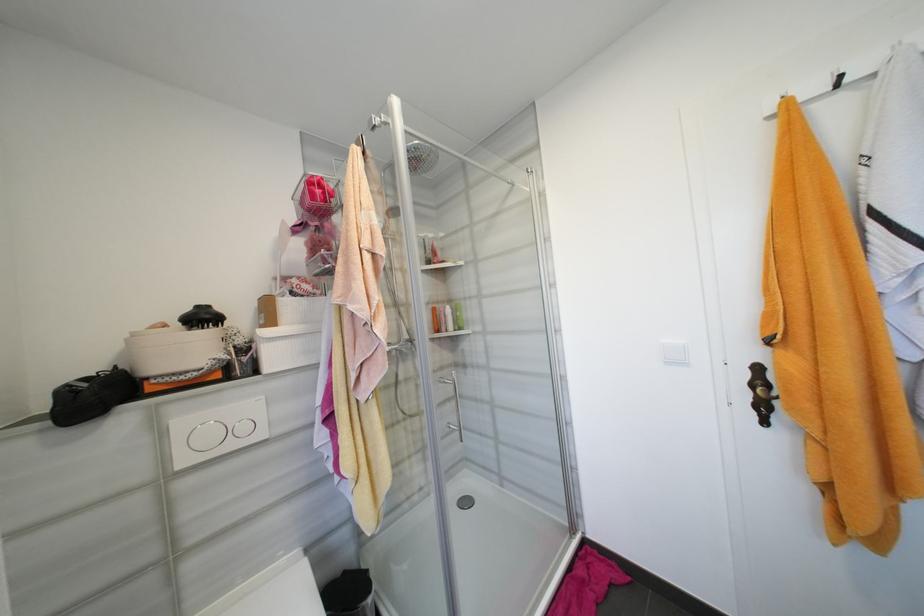
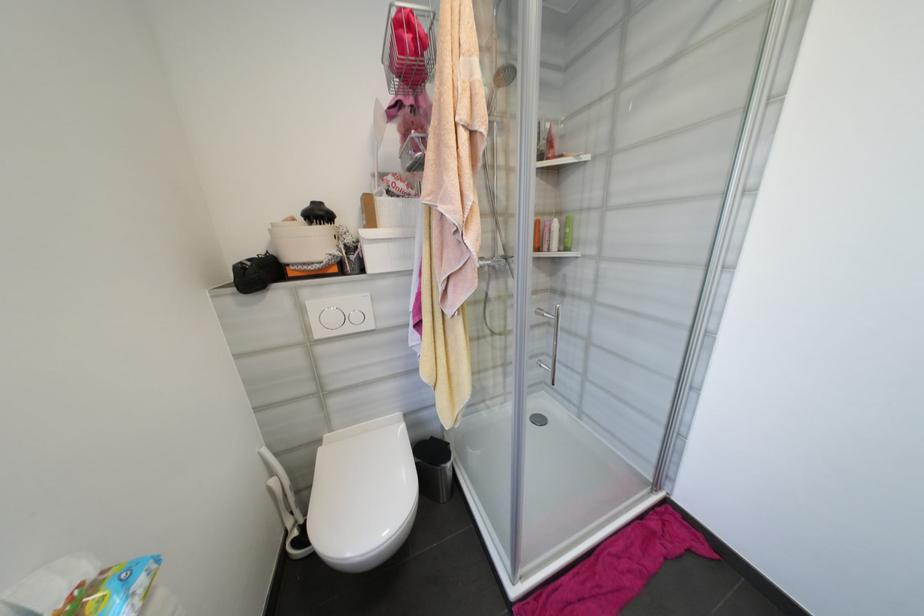
Where in the second image is the point corresponding to pixel 386 253 from the first image?

(488, 127)